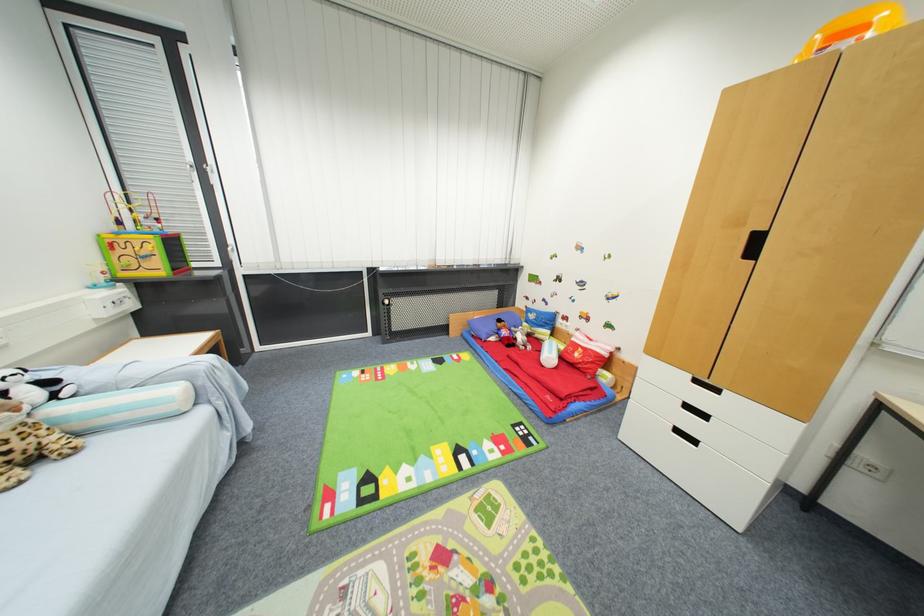
Identify the location of striped bolster pillow. This screenshot has width=924, height=616. (116, 408).